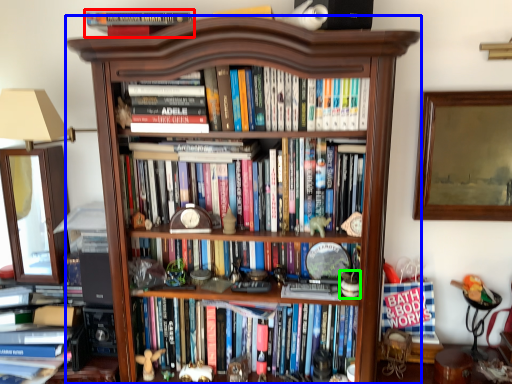
Question: Estimate the real-world distances between objects in this image. Which object is farther from book (highlighted by a red box), bookcase (highlighted by a blue box) or toy (highlighted by a green box)?

Choices:
 (A) bookcase
 (B) toy

Answer: (B)